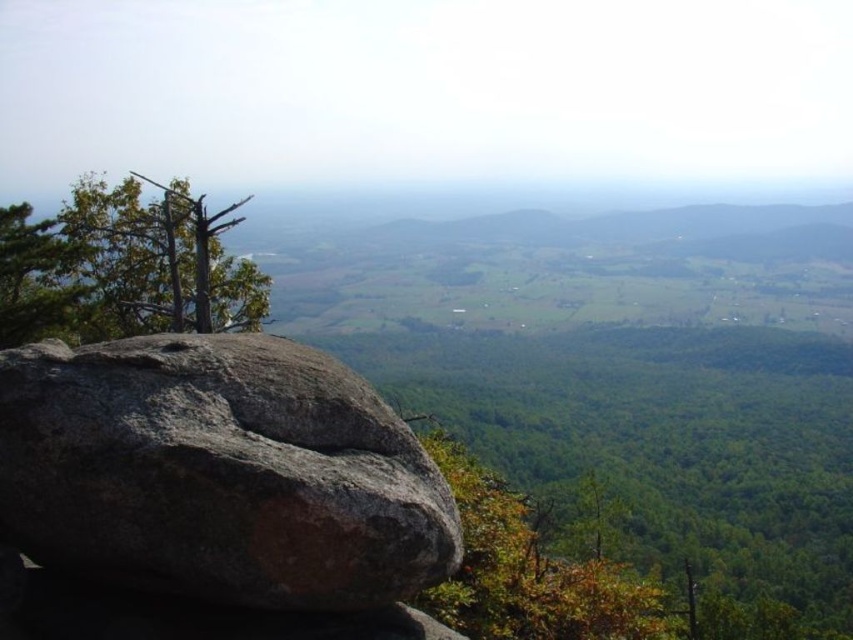
Question: Can you confirm if gray rough rock at center is smaller than green leafy tree at upper left?

Choices:
 (A) yes
 (B) no

Answer: (A)

Question: Is gray rough rock at center further to the viewer compared to green leafy tree at upper left?

Choices:
 (A) yes
 (B) no

Answer: (B)

Question: Does gray rough rock at center have a larger size compared to green leafy tree at upper left?

Choices:
 (A) yes
 (B) no

Answer: (B)

Question: Which point is farther from the camera taking this photo?

Choices:
 (A) (451, 566)
 (B) (198, 212)

Answer: (B)

Question: Which of the following is the farthest from the observer?

Choices:
 (A) green leafy tree at upper left
 (B) gray rough rock at center

Answer: (A)

Question: Among these objects, which one is nearest to the camera?

Choices:
 (A) gray rough rock at center
 (B) green leafy tree at upper left

Answer: (A)